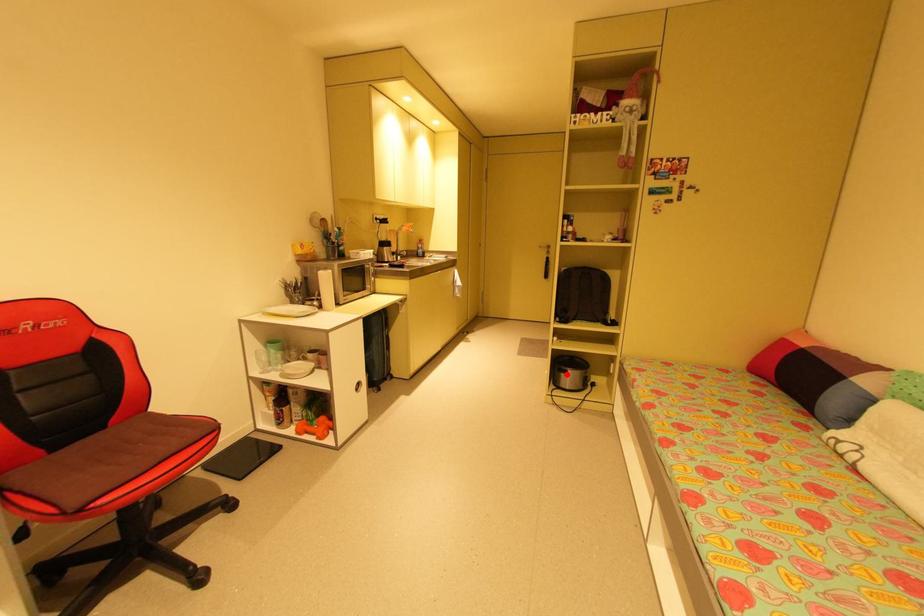
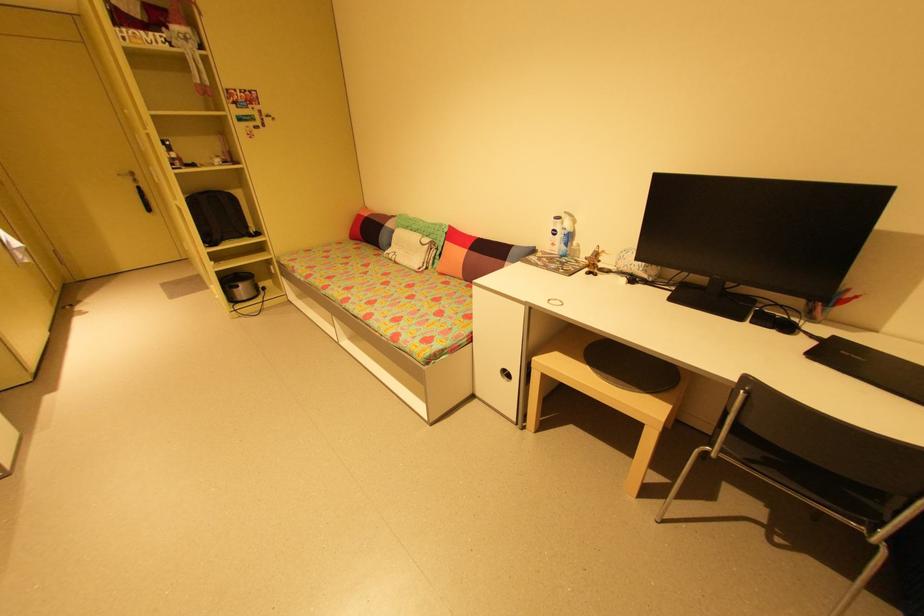
Question: I am providing you with two images of the same scene from different viewpoints. A red point is shown in image1. For the corresponding object point in image2, is it positioned nearer or farther from the camera?

Choices:
 (A) Nearer
 (B) Farther

Answer: (A)